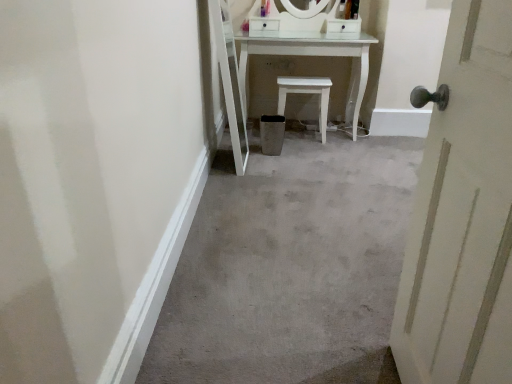
Question: Do you think white painted wood door at right is within white matte stool at center, or outside of it?

Choices:
 (A) outside
 (B) inside

Answer: (A)

Question: From a real-world perspective, relative to white matte stool at center, is white painted wood door at right vertically above or below?

Choices:
 (A) above
 (B) below

Answer: (A)

Question: From the image's perspective, is white painted wood door at right positioned above or below white matte stool at center?

Choices:
 (A) below
 (B) above

Answer: (A)

Question: Considering their positions, is white matte stool at center located in front of or behind white painted wood door at right?

Choices:
 (A) front
 (B) behind

Answer: (B)

Question: Considering the positions of white matte stool at center and white painted wood door at right in the image, is white matte stool at center bigger or smaller than white painted wood door at right?

Choices:
 (A) small
 (B) big

Answer: (A)

Question: Considering the positions of white matte stool at center and white painted wood door at right in the image, is white matte stool at center taller or shorter than white painted wood door at right?

Choices:
 (A) tall
 (B) short

Answer: (B)

Question: From the image's perspective, relative to white painted wood door at right, is white matte stool at center above or below?

Choices:
 (A) above
 (B) below

Answer: (A)